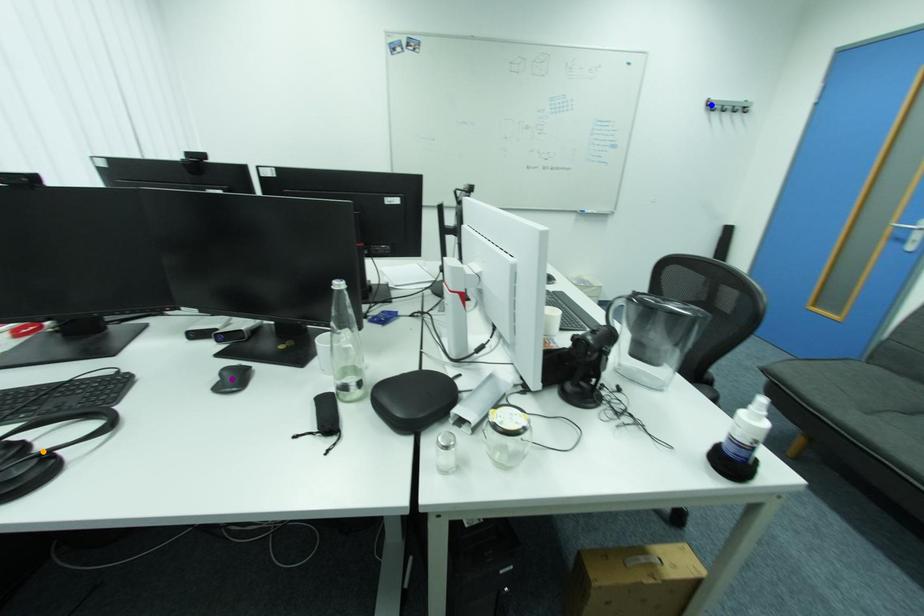
Order these from nearest to farthest:
1. purple point
2. blue point
3. orange point

blue point < purple point < orange point